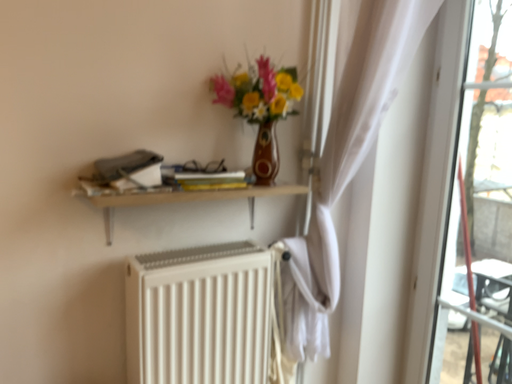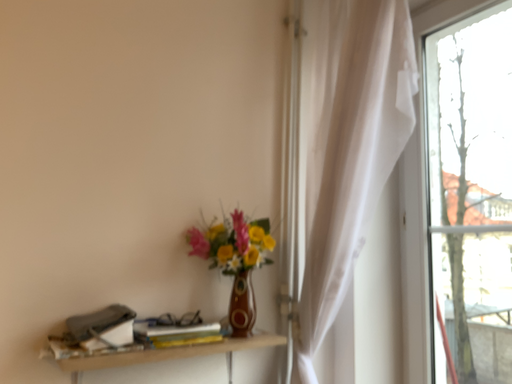
Question: How did the camera likely rotate when shooting the video?

Choices:
 (A) rotated downward
 (B) rotated upward

Answer: (B)